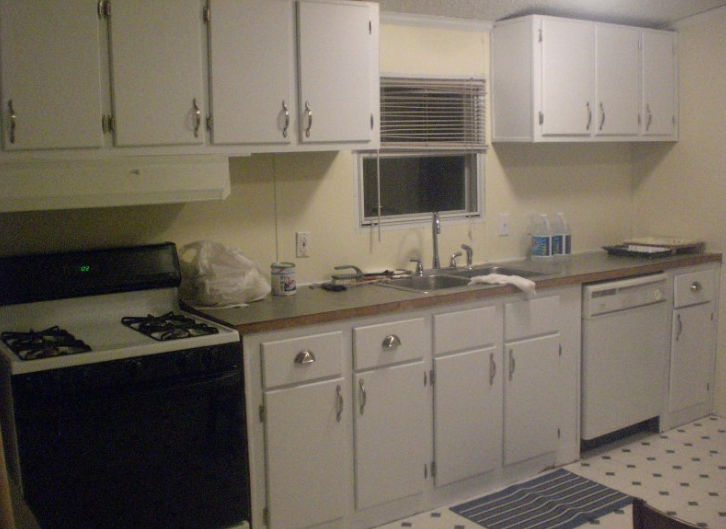
The width and height of the screenshot is (726, 529). Find the location of `wall`. wall is located at coordinates (329, 205).